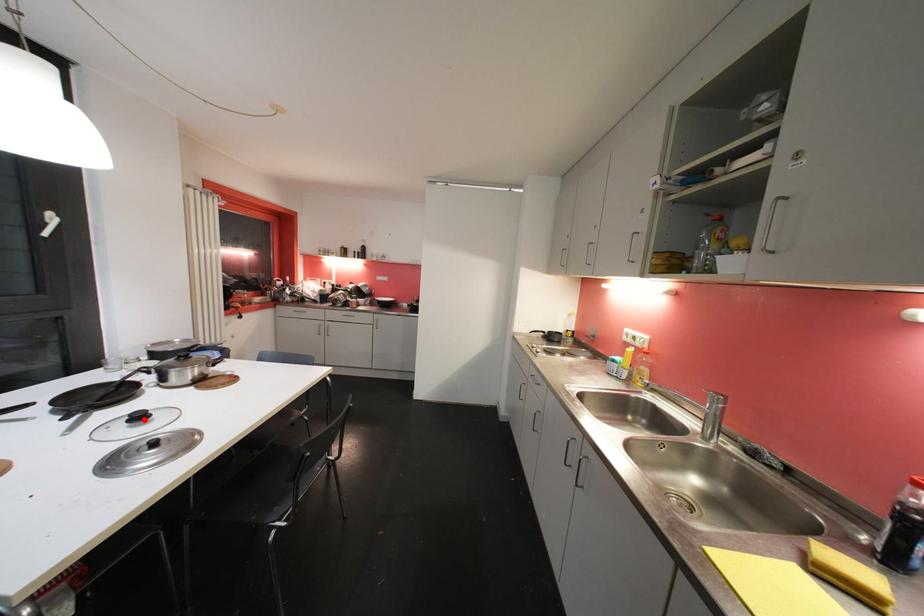
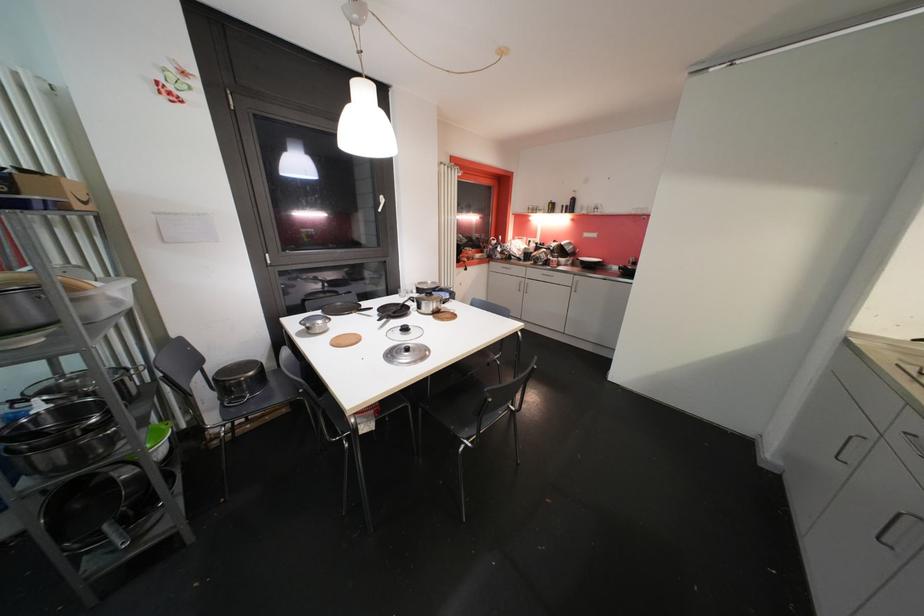
In the second image, find the point that corresponds to the highlighted location in the first image.

(409, 331)